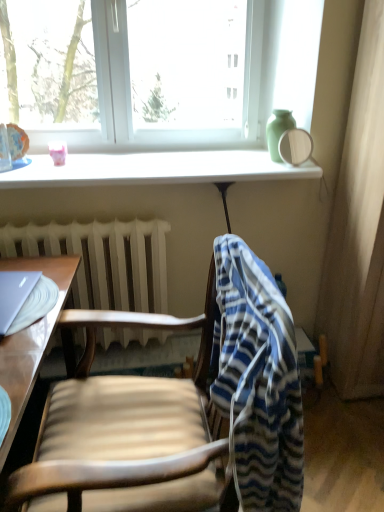
Question: Are transparent glass mirror at upper right and green matte vase at upper right far apart?

Choices:
 (A) no
 (B) yes

Answer: (B)

Question: Is transparent glass mirror at upper right positioned in front of green matte vase at upper right?

Choices:
 (A) yes
 (B) no

Answer: (A)

Question: Is transparent glass mirror at upper right smaller than green matte vase at upper right?

Choices:
 (A) no
 (B) yes

Answer: (B)

Question: Is transparent glass mirror at upper right thinner than green matte vase at upper right?

Choices:
 (A) no
 (B) yes

Answer: (B)

Question: From the image's perspective, does transparent glass mirror at upper right appear higher than green matte vase at upper right?

Choices:
 (A) no
 (B) yes

Answer: (A)

Question: Is transparent glass mirror at upper right taller than green matte vase at upper right?

Choices:
 (A) yes
 (B) no

Answer: (B)

Question: Does white matte radiator at lower center have a lesser height compared to satin silver laptop at left?

Choices:
 (A) no
 (B) yes

Answer: (A)

Question: Can you confirm if white matte radiator at lower center is smaller than satin silver laptop at left?

Choices:
 (A) no
 (B) yes

Answer: (A)

Question: Can you confirm if white matte radiator at lower center is taller than satin silver laptop at left?

Choices:
 (A) yes
 (B) no

Answer: (A)

Question: From the image's perspective, is white matte radiator at lower center under satin silver laptop at left?

Choices:
 (A) no
 (B) yes

Answer: (B)

Question: From a real-world perspective, is white matte radiator at lower center under satin silver laptop at left?

Choices:
 (A) no
 (B) yes

Answer: (B)

Question: Is white matte radiator at lower center closer to the viewer compared to satin silver laptop at left?

Choices:
 (A) yes
 (B) no

Answer: (B)

Question: Can you confirm if transparent glass mirror at upper right is bigger than blue striped fabric at center?

Choices:
 (A) no
 (B) yes

Answer: (A)